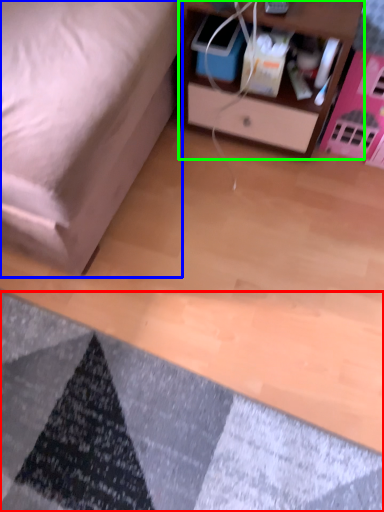
Question: Considering the real-world distances, which object is farthest from mat (highlighted by a red box)? furniture (highlighted by a blue box) or nightstand (highlighted by a green box)?

Choices:
 (A) furniture
 (B) nightstand

Answer: (B)